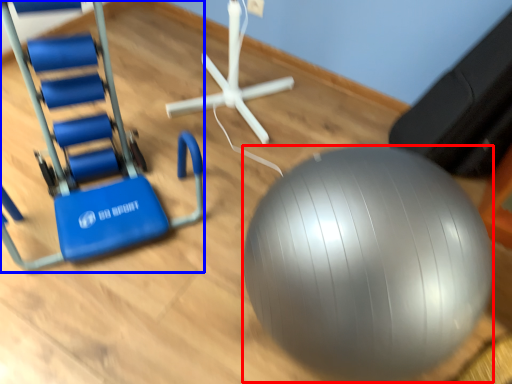
Question: Which object is closer to the camera taking this photo, ball (highlighted by a red box) or swivel chair (highlighted by a blue box)?

Choices:
 (A) ball
 (B) swivel chair

Answer: (A)